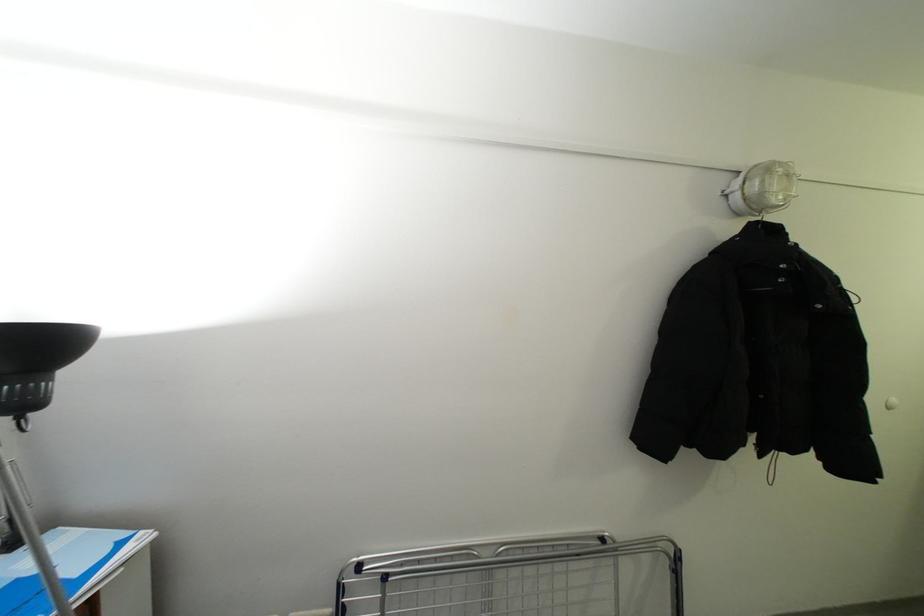
Where would you adjust the black lamp head? Please return your answer as a coordinate pair (x, y).

(768, 187)